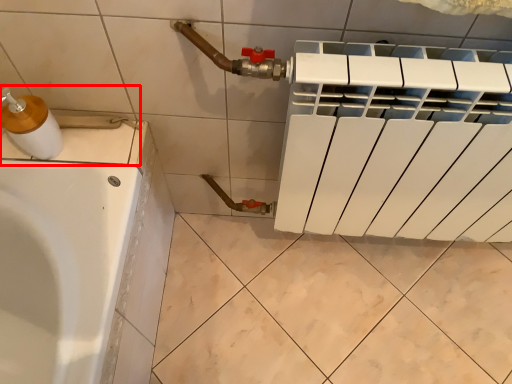
Question: In this image, where is sink (annotated by the red box) located relative to soap dispenser?

Choices:
 (A) left
 (B) right

Answer: (A)